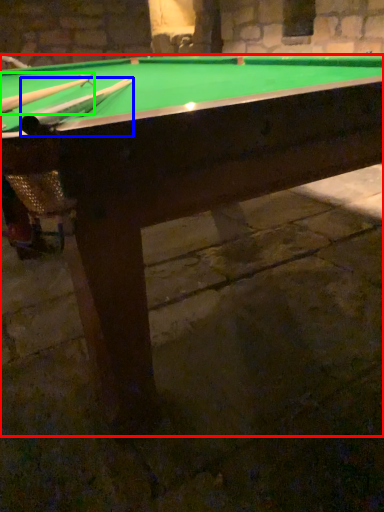
Question: Which is nearer to the billiard table (highlighted by a red box)? cue (highlighted by a blue box) or cue (highlighted by a green box).

Choices:
 (A) cue
 (B) cue

Answer: (A)